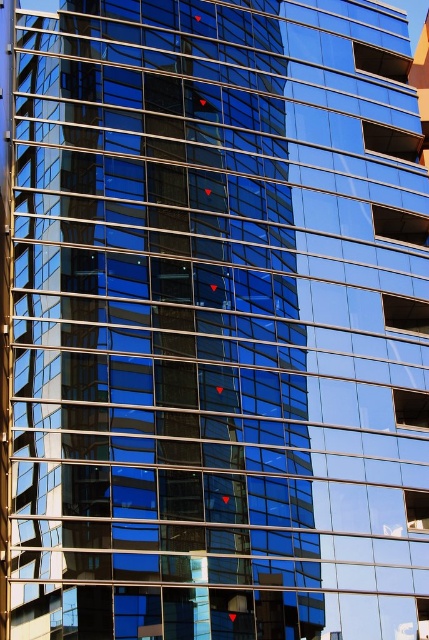
Question: Which point is farther to the camera?

Choices:
 (A) blue glass window at center
 (B) transparent glass window at center

Answer: (A)

Question: Which point is farther to the camera?

Choices:
 (A) transparent glass window at center-right
 (B) clear glass window at center-right
 (C) transparent glass window at center

Answer: (C)

Question: Is transparent glass window at center positioned in front of clear glass window at upper right?

Choices:
 (A) no
 (B) yes

Answer: (B)

Question: Estimate the real-world distances between objects in this image. Which object is closer to the blue glass window at center?

Choices:
 (A) transparent glass window at center-right
 (B) transparent glass window at right
 (C) transparent glass window at center
 (D) clear glass window at upper right

Answer: (D)

Question: In this image, where is transparent glass window at right located relative to clear glass window at upper right?

Choices:
 (A) below
 (B) above

Answer: (A)

Question: Is transparent glass window at right above transparent glass window at center-right?

Choices:
 (A) no
 (B) yes

Answer: (B)